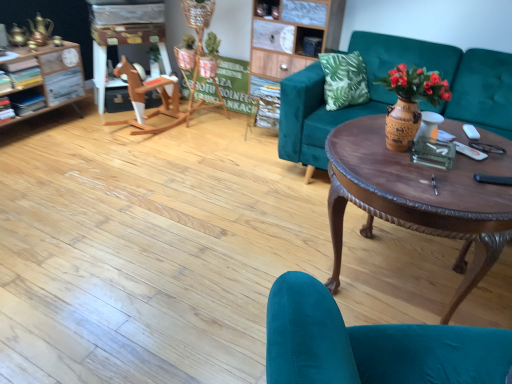
Where is `free space in front of wooden rocking horse at left`? free space in front of wooden rocking horse at left is located at coordinates point(138,158).